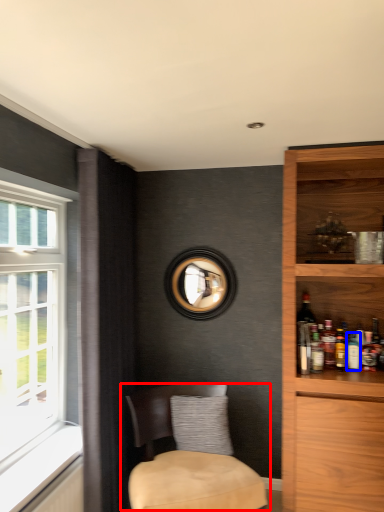
Question: Which point is further to the camera, chair (highlighted by a red box) or beverage (highlighted by a blue box)?

Choices:
 (A) chair
 (B) beverage

Answer: (B)